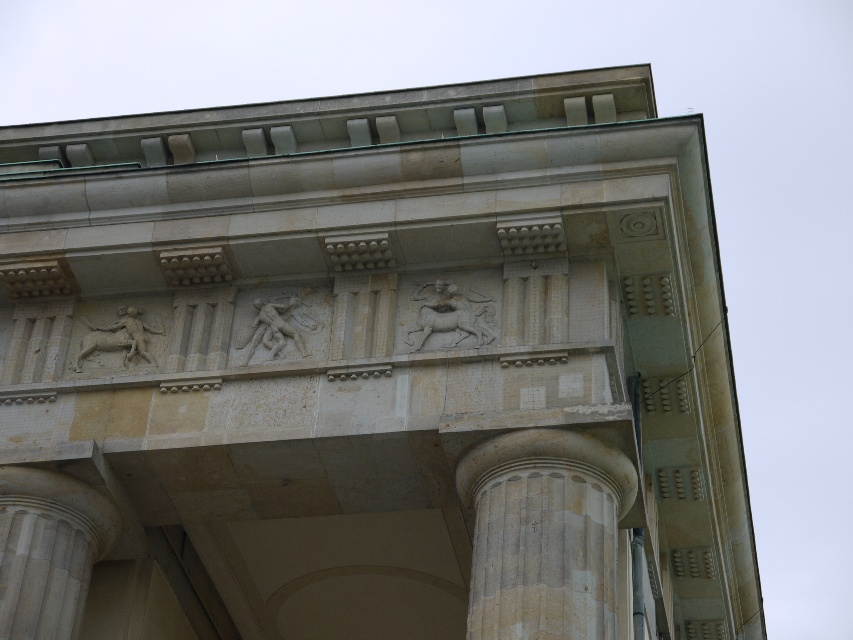
You are an architect examining the classical facade. You notice two columns, the smooth stone column at center and the smooth stone column at lower left. Which column blocks the view of the other?

The smooth stone column at center is in front of the smooth stone column at lower left, so it blocks the view of the latter.

You are an architect examining the classical structure. You notice two columns, the smooth stone column at center and the smooth stone column at lower left. Which column is located more to the left side of the structure?

The smooth stone column at lower left is more to the left side of the structure because the smooth stone column at center is positioned on the right side of it.

You are an architect examining the classical structure. The smooth stone column at center is part of the facade. Based on its position, can you determine if it is closer to the top or bottom of the structure?

The smooth stone column at center is located at point coordinates indicating it is closer to the bottom of the structure since its y coordinate is 0.639, which is below the midpoint of the image height.